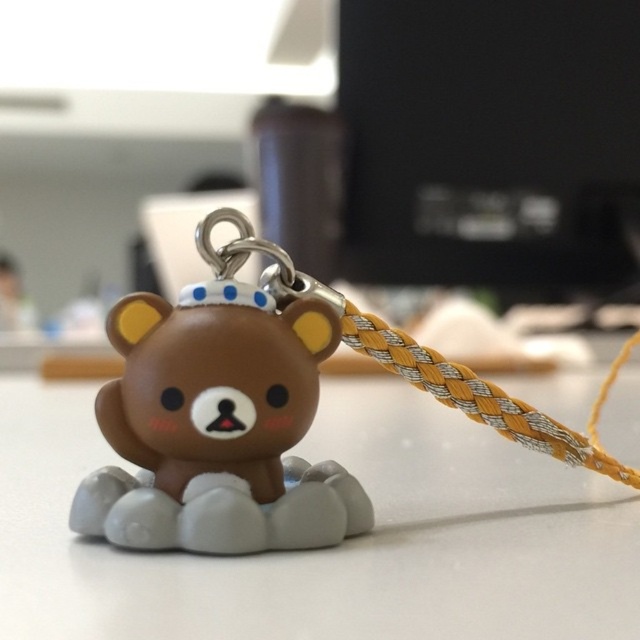
You are looking at the image and want to place a small sticker on the closest object to you between the white matte table at center and the matte brown plush bear at center. Which object should you choose?

The white matte table at center is closer to the viewer than the matte brown plush bear at center, so you should place the sticker on the white matte table at center.

You are holding a small bear keychain with two points marked on it. The first point is at coordinates point (504, 572) and the second point is at point (189, 364). From your perspective, which point is closer to you?

Point (504, 572) is in front of point (189, 364), so it is closer to you.